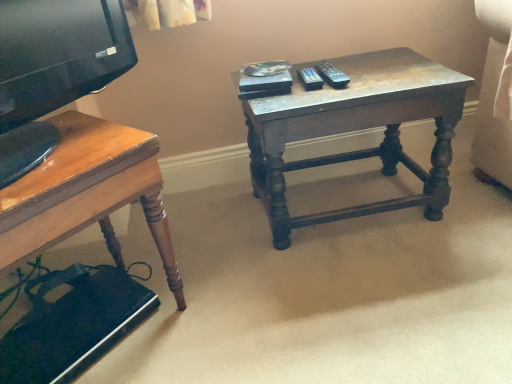
Identify the location of vacant area that is in front of distressed wood table at center. The width and height of the screenshot is (512, 384). (371, 292).